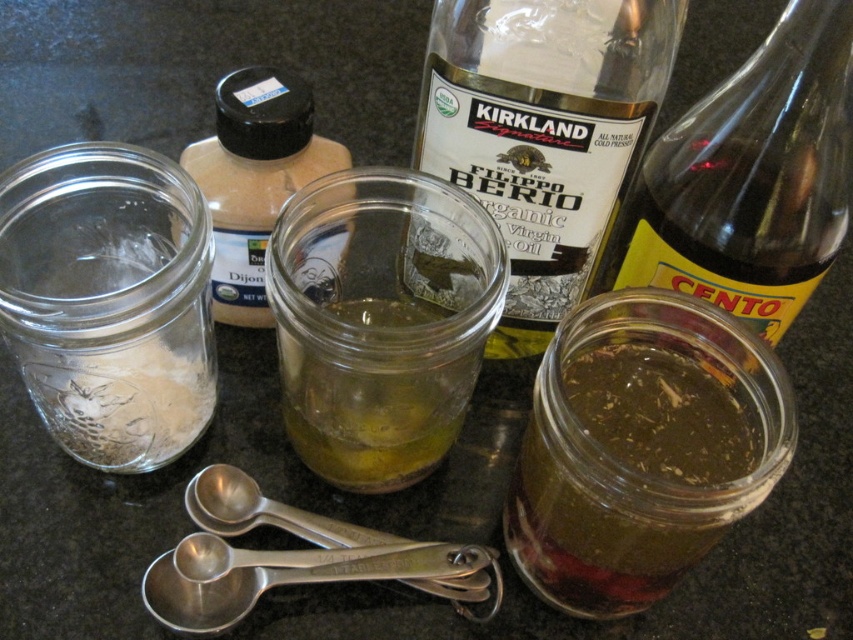
Measure the distance between clear glass bottle at center and camera.

clear glass bottle at center and camera are 14.93 inches apart.

Consider the image. Does clear glass bottle at center come in front of green translucent liquid at center right?

No.

Which is behind, point (434, 48) or point (654, 464)?

The point (434, 48) is more distant.

Image resolution: width=853 pixels, height=640 pixels. I want to click on clear glass bottle at center, so click(543, 145).

Which is in front, point (209, 186) or point (347, 474)?

Point (347, 474)

Who is positioned more to the left, clear glass jar at upper left or green gelatinous substance at center?

clear glass jar at upper left is more to the left.

What do you see at coordinates (254, 179) in the screenshot?
I see `clear glass jar at upper left` at bounding box center [254, 179].

Find the location of a particular element. The image size is (853, 640). clear glass jar at upper left is located at coordinates (254, 179).

Is silver metallic measuring spoons at lower center to the left of silver metallic measuring spoons at center from the viewer's perspective?

No, silver metallic measuring spoons at lower center is not to the left of silver metallic measuring spoons at center.

Between silver metallic measuring spoons at lower center and silver metallic measuring spoons at center, which one appears on the left side from the viewer's perspective?

From the viewer's perspective, silver metallic measuring spoons at center appears more on the left side.

You are a GUI agent. You are given a task and a screenshot of the screen. Output one action in this format:
    pyautogui.click(x=<x>, y=<y>)
    Task: Click on the silver metallic measuring spoons at lower center
    
    Given the screenshot: What is the action you would take?
    click(329, 561)